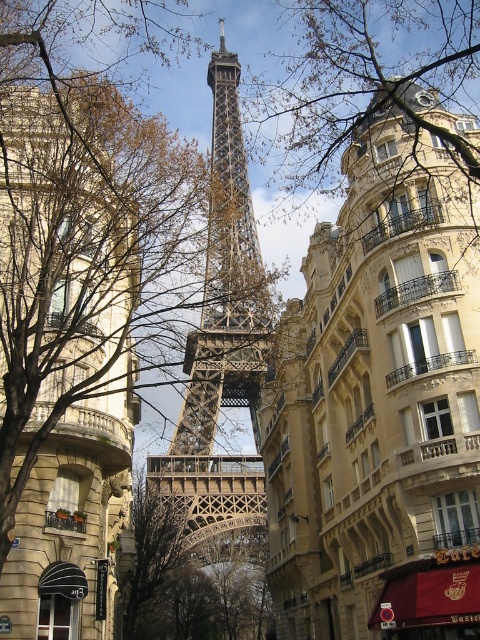
Which of these two, golden stone building at center or brown leafless branches at center, stands shorter?

With less height is brown leafless branches at center.

Is golden stone building at center wider than brown leafless branches at center?

No.

Who is more forward, [336,536] or [372,17]?

Positioned in front is point [336,536].

This screenshot has width=480, height=640. I want to click on golden stone building at center, so click(380, 403).

Can you confirm if brown leafless branches at center is positioned above metallic lattice structure at center?

Correct, brown leafless branches at center is located above metallic lattice structure at center.

Identify the location of brown leafless branches at center. (369, 80).

At what (x,y) coordinates should I click in order to perform the action: click on brown leafless branches at center. Please return your answer as a coordinate pair (x, y). The height and width of the screenshot is (640, 480). Looking at the image, I should click on (369, 80).

Which is in front, point (339, 467) or point (236, 380)?

Point (339, 467) is in front.

Where is `golden stone building at center`? golden stone building at center is located at coordinates (380, 403).